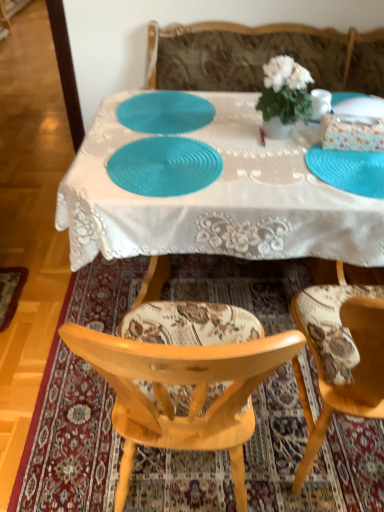
Identify the location of vacant space situated above teal textured plate at center, acting as the 2th plate starting from the left (from a real-world perspective). This screenshot has height=512, width=384. (165, 163).